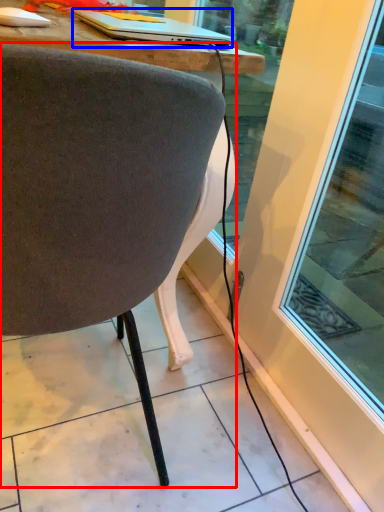
Question: Among these objects, which one is nearest to the camera, chair (highlighted by a red box) or laptop (highlighted by a blue box)?

Choices:
 (A) chair
 (B) laptop

Answer: (A)